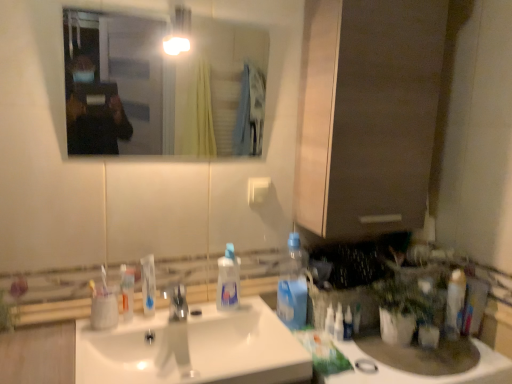
You are a GUI agent. You are given a task and a screenshot of the screen. Output one action in this format:
    pyautogui.click(x=<x>, y=<y>)
    Task: Click on the free location to the right of polished chrome faucet at center
    This screenshot has height=384, width=512.
    Given the screenshot: What is the action you would take?
    pyautogui.click(x=231, y=319)